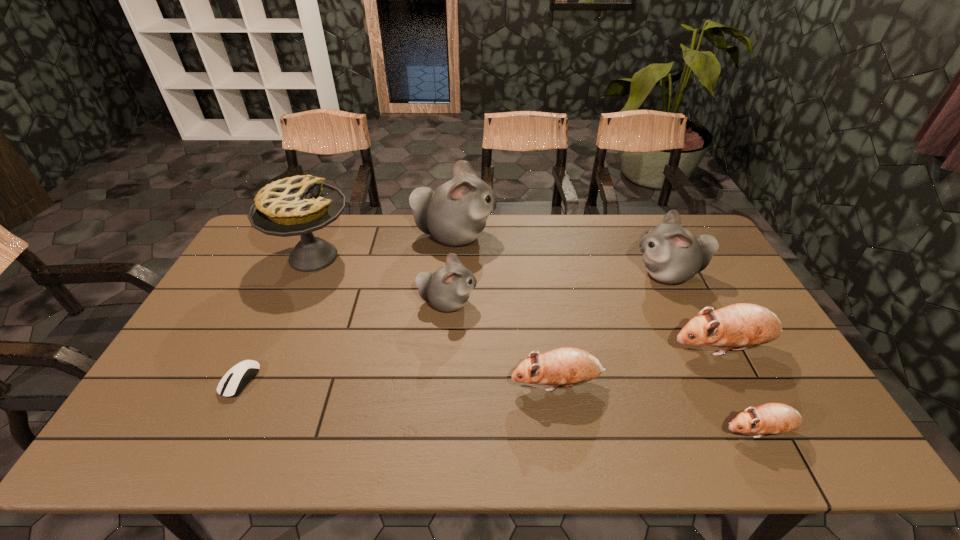
Locate an element on the screen. hamster situated at the far edge is located at coordinates (455, 213).

Locate an element on the screen. pie that is at the far edge is located at coordinates (299, 205).

Where is `object present at the near edge`? Image resolution: width=960 pixels, height=540 pixels. object present at the near edge is located at coordinates (772, 418).

Where is `pie present at the left edge`? This screenshot has height=540, width=960. pie present at the left edge is located at coordinates 299,205.

The height and width of the screenshot is (540, 960). What are the coordinates of `mouse situated at the left edge` in the screenshot? It's located at (234, 381).

You are a GUI agent. You are given a task and a screenshot of the screen. Output one action in this format:
    pyautogui.click(x=<x>, y=<y>)
    Task: Click on the object that is at the far left corner
    The height and width of the screenshot is (540, 960).
    Given the screenshot: What is the action you would take?
    pyautogui.click(x=299, y=205)

Where is `object at the near right corner`? Image resolution: width=960 pixels, height=540 pixels. object at the near right corner is located at coordinates (772, 418).

Image resolution: width=960 pixels, height=540 pixels. In order to click on vacant space at the far edge in this screenshot , I will do `click(537, 217)`.

In order to click on free location at the near edge in this screenshot , I will do `click(768, 458)`.

This screenshot has width=960, height=540. What are the coordinates of `vacant space at the left edge` in the screenshot? It's located at click(207, 338).